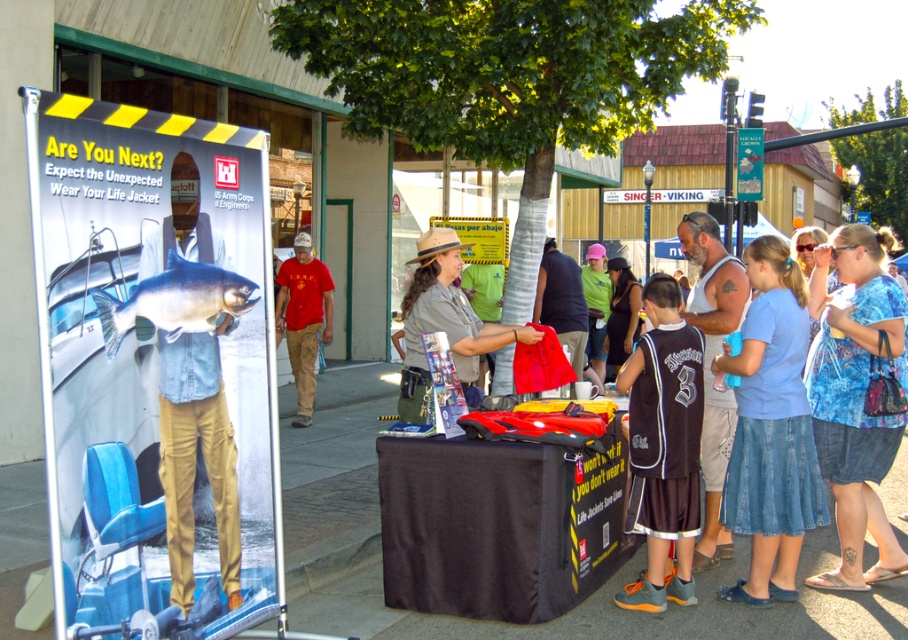
Question: Which of the following is the closest to the observer?

Choices:
 (A) (640, 371)
 (B) (850, 470)

Answer: (A)

Question: Which point is farther to the camera?

Choices:
 (A) (469, 440)
 (B) (655, 435)
 (C) (114, 596)
 (D) (238, 307)

Answer: (B)

Question: Is metallic silver fish at left below black jersey at center?

Choices:
 (A) yes
 (B) no

Answer: (B)

Question: Is denim skirt at center bigger than blue denim shorts at lower right?

Choices:
 (A) no
 (B) yes

Answer: (B)

Question: Which of these objects is positioned closest to the shiny blue fish at center?

Choices:
 (A) denim skirt at center
 (B) red cotton shirt at center
 (C) blue denim shorts at lower right

Answer: (A)

Question: Can you confirm if blue denim shorts at lower right is bigger than black jersey at center?

Choices:
 (A) no
 (B) yes

Answer: (B)